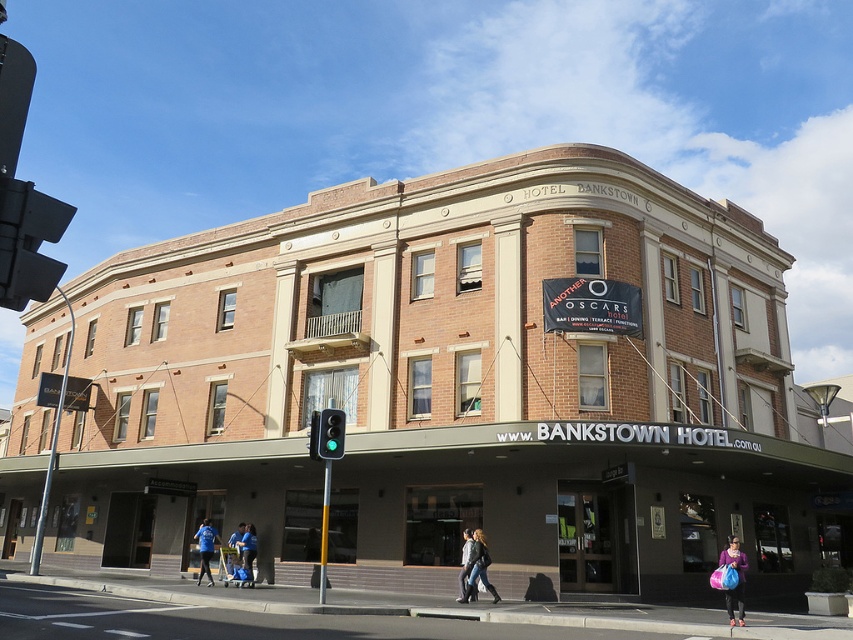
From the picture: Is purple fabric bag at lower right shorter than blue fabric shirt at lower center?

Correct, purple fabric bag at lower right is not as tall as blue fabric shirt at lower center.

Does purple fabric bag at lower right have a larger size compared to blue fabric shirt at lower center?

No, purple fabric bag at lower right is not bigger than blue fabric shirt at lower center.

Describe the element at coordinates (737, 577) in the screenshot. The image size is (853, 640). I see `purple fabric bag at lower right` at that location.

Locate an element on the screen. purple fabric bag at lower right is located at coordinates (737, 577).

From the picture: Does purple fabric bag at lower right have a larger size compared to leather jacket at center?

No.

Where is `purple fabric bag at lower right`? The image size is (853, 640). purple fabric bag at lower right is located at coordinates (737, 577).

I want to click on purple fabric bag at lower right, so click(x=737, y=577).

Is leather jacket at center wider than blue fabric bag at lower center?

Incorrect, leather jacket at center's width does not surpass blue fabric bag at lower center's.

Between leather jacket at center and blue fabric bag at lower center, which one is positioned higher?

leather jacket at center is above.

Between point (463, 531) and point (225, 564), which one is positioned behind?

The point (225, 564) is behind.

Find the location of a particular element. The image size is (853, 640). leather jacket at center is located at coordinates (466, 566).